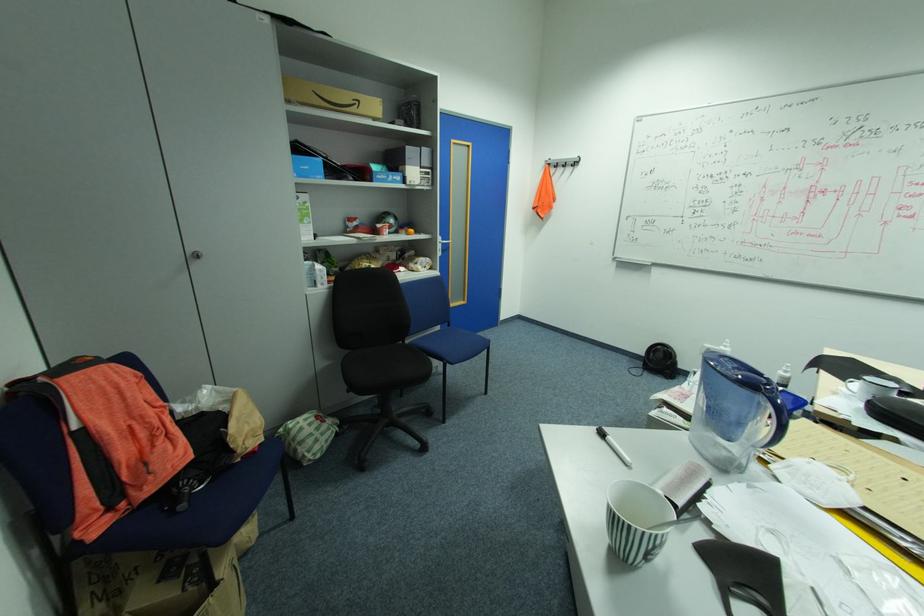
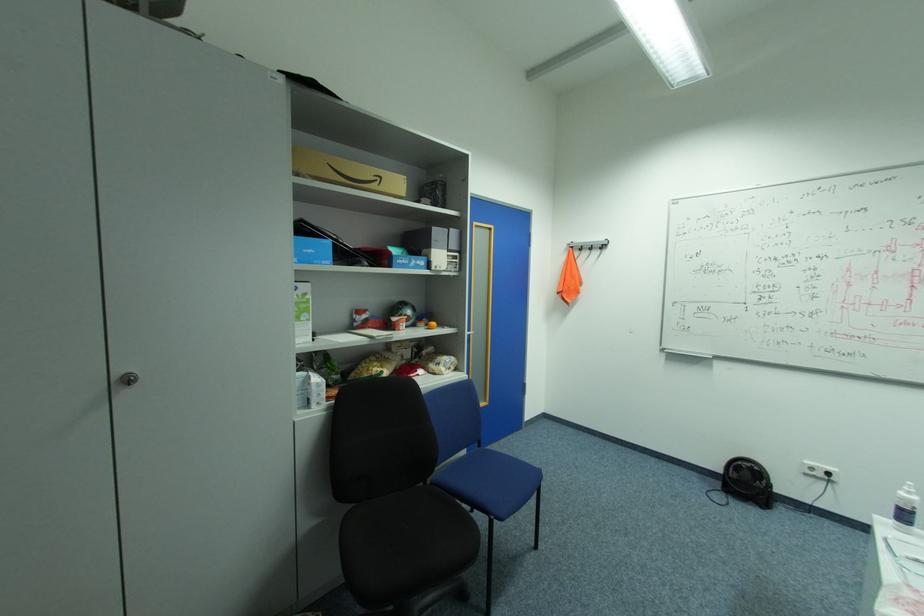
In the second image, find the point that corresponds to the point at 366,100 in the first image.

(386, 177)